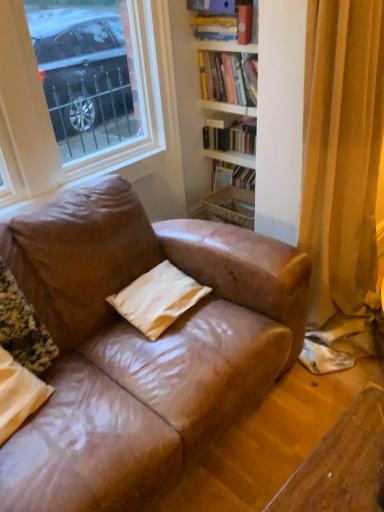
Question: Is white matte pillow at center, the 2th pillow from the left, at the left side of matte beige pillow at lower left, the first pillow when ordered from left to right?

Choices:
 (A) yes
 (B) no

Answer: (B)

Question: Is white matte pillow at center, the first pillow from the right, not close to matte beige pillow at lower left, the first pillow when ordered from left to right?

Choices:
 (A) no
 (B) yes

Answer: (A)

Question: Does white matte pillow at center, the 2th pillow from the left, have a smaller size compared to matte beige pillow at lower left, the first pillow when ordered from left to right?

Choices:
 (A) no
 (B) yes

Answer: (B)

Question: Is white matte pillow at center, the first pillow from the right, positioned behind matte beige pillow at lower left, the first pillow when ordered from left to right?

Choices:
 (A) yes
 (B) no

Answer: (A)

Question: Considering the relative sizes of white matte pillow at center, the first pillow from the right, and matte beige pillow at lower left, the first pillow when ordered from left to right, in the image provided, is white matte pillow at center, the first pillow from the right, bigger than matte beige pillow at lower left, the first pillow when ordered from left to right,?

Choices:
 (A) yes
 (B) no

Answer: (B)

Question: From the image's perspective, is white matte bookshelf at upper center, acting as the 3th book starting from the top, positioned above or below matte hardcover book at upper right, which appears as the 1th book when viewed from the top?

Choices:
 (A) above
 (B) below

Answer: (B)

Question: Is white matte bookshelf at upper center, acting as the 3th book starting from the top, inside the boundaries of matte hardcover book at upper right, the third book positioned from the bottom, or outside?

Choices:
 (A) outside
 (B) inside

Answer: (A)

Question: Relative to matte hardcover book at upper right, which appears as the 1th book when viewed from the top, is white matte bookshelf at upper center, acting as the 3th book starting from the top, in front or behind?

Choices:
 (A) front
 (B) behind

Answer: (B)

Question: Is white matte bookshelf at upper center, which is counted as the first book, starting from the bottom, bigger or smaller than matte hardcover book at upper right, the third book positioned from the bottom?

Choices:
 (A) small
 (B) big

Answer: (A)

Question: Choose the correct answer: Is matte hardcover book at upper right, which appears as the 1th book when viewed from the top, inside white matte pillow at center, the 2th pillow from the left, or outside it?

Choices:
 (A) inside
 (B) outside

Answer: (B)

Question: From their relative heights in the image, would you say matte hardcover book at upper right, which appears as the 1th book when viewed from the top, is taller or shorter than white matte pillow at center, the 2th pillow from the left?

Choices:
 (A) tall
 (B) short

Answer: (A)

Question: Does point (205, 20) appear closer or farther from the camera than point (160, 271)?

Choices:
 (A) farther
 (B) closer

Answer: (A)

Question: From a real-world perspective, is matte hardcover book at upper right, which appears as the 1th book when viewed from the top, above or below white matte pillow at center, the 2th pillow from the left?

Choices:
 (A) above
 (B) below

Answer: (A)

Question: Considering the positions of matte hardcover book at upper right, which appears as the 1th book when viewed from the top, and matte beige pillow at lower left, the second pillow from the right, in the image, is matte hardcover book at upper right, which appears as the 1th book when viewed from the top, taller or shorter than matte beige pillow at lower left, the second pillow from the right,?

Choices:
 (A) short
 (B) tall

Answer: (A)

Question: From the image's perspective, relative to matte beige pillow at lower left, the second pillow from the right, is matte hardcover book at upper right, which appears as the 1th book when viewed from the top, above or below?

Choices:
 (A) above
 (B) below

Answer: (A)